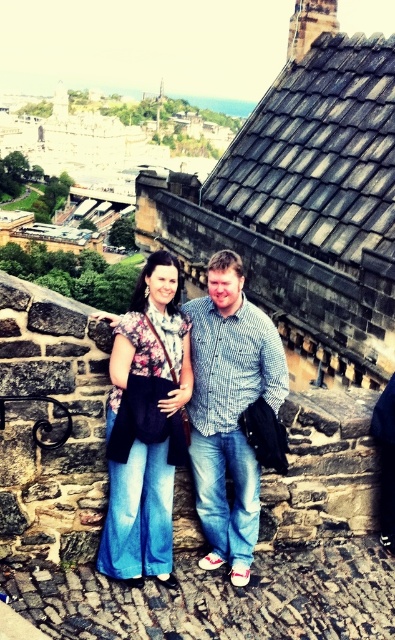
Question: Which is farther from the checkered fabric shirt at center?

Choices:
 (A) floral fabric top at center
 (B) gray slate roof at upper center

Answer: (B)

Question: Where is gray slate roof at upper center located in relation to checkered fabric shirt at center in the image?

Choices:
 (A) right
 (B) left

Answer: (A)

Question: Which object is closer to the camera taking this photo?

Choices:
 (A) checkered fabric shirt at center
 (B) floral fabric top at center
 (C) gray slate roof at upper center

Answer: (B)

Question: Does floral fabric top at center have a lesser width compared to checkered fabric shirt at center?

Choices:
 (A) no
 (B) yes

Answer: (B)

Question: Which point appears farthest from the camera in this image?

Choices:
 (A) (280, 376)
 (B) (261, 108)
 (C) (180, 384)

Answer: (B)

Question: Does gray slate roof at upper center appear on the right side of checkered fabric shirt at center?

Choices:
 (A) yes
 (B) no

Answer: (A)